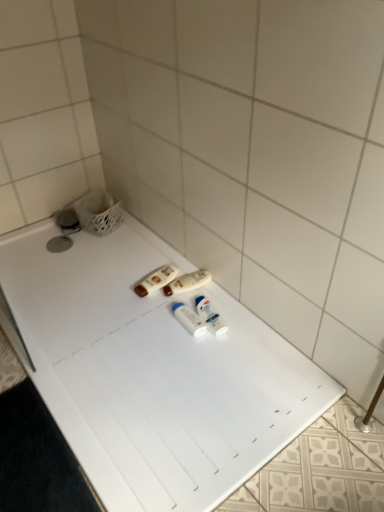
What are the coordinates of `free space in front of white plastic deodorant at center, marked as the fourth toiletry in a left-to-right arrangement` in the screenshot? It's located at (208, 357).